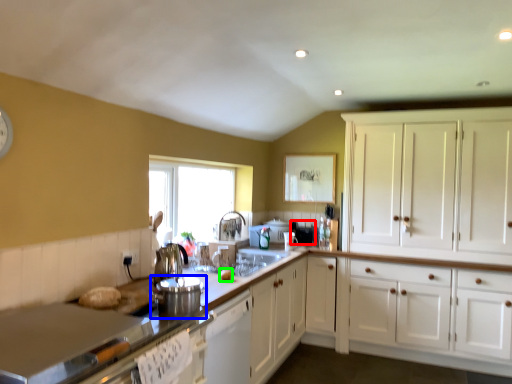
Question: Considering the real-world distances, which object is farthest from appliance (highlighted by a red box)? appliance (highlighted by a blue box) or food (highlighted by a green box)?

Choices:
 (A) appliance
 (B) food

Answer: (A)